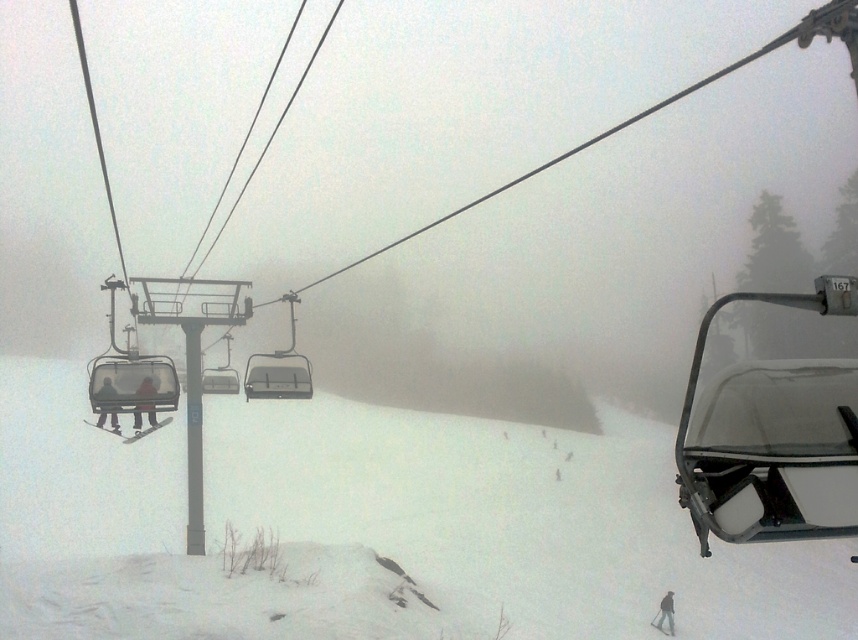
Question: Does dark gray snow pants at lower right come behind matte black ski at left?

Choices:
 (A) yes
 (B) no

Answer: (A)

Question: Which point appears closest to the camera in this image?

Choices:
 (A) (112, 428)
 (B) (246, 381)
 (C) (662, 620)

Answer: (A)

Question: Is the position of metallic gray ski lift at center less distant than that of red fabric jacket at center?

Choices:
 (A) yes
 (B) no

Answer: (B)

Question: Is white snow at lower left further to camera compared to matte black ski at left?

Choices:
 (A) yes
 (B) no

Answer: (B)

Question: Which point is farther to the camera?

Choices:
 (A) 666,605
 (B) 118,433
 (C) 136,433

Answer: (A)

Question: Which is nearer to the white snow at lower left?

Choices:
 (A) red fabric jacket at center
 (B) metallic gray chairlift at center

Answer: (B)